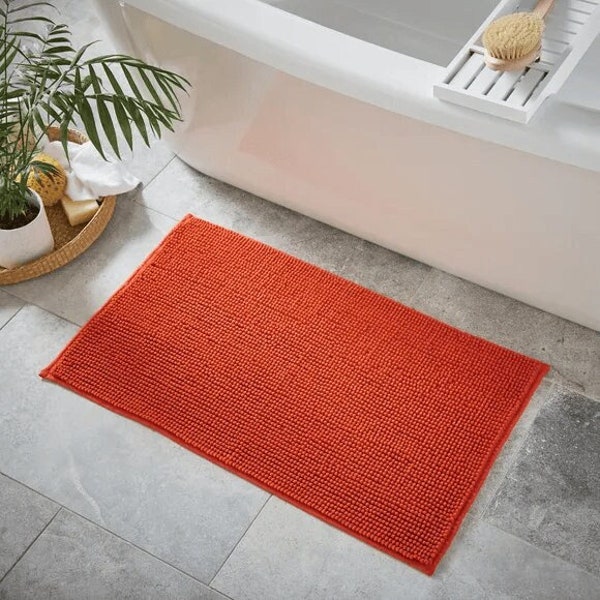
At what (x,y) coordinates should I click in order to perform the action: click on tray. Please return your answer as a coordinate pair (x, y). Looking at the image, I should click on (64, 239).